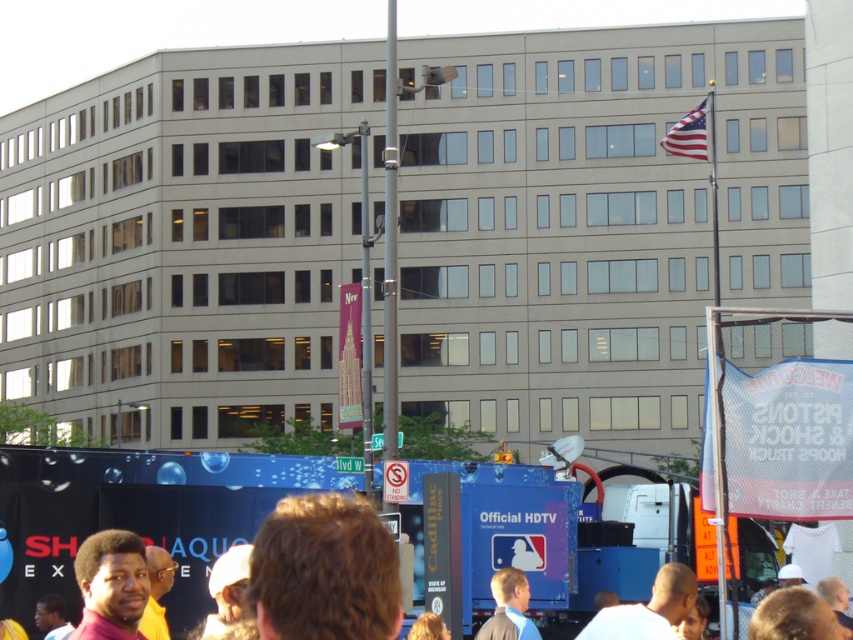
Looking at this image, you are a photographer trying to capture a photo of the MLB truck in the middle ground. You notice two people in the foreground blocking your shot. One has dark brown skin at lower left and the other wears a white fabric turban at lower center. Which person is shorter and should you ask to step back to avoid blocking the MLB truck?

The dark brown skin at lower left is shorter than the white fabric turban at lower center. However, since both are blocking the MLB truck, you should ask both to step back for a clear view.

You are a photographer trying to capture a photo of the dark brown skin at lower left and the white fabric turban at lower center. Which of the two objects is positioned higher in the image?

The dark brown skin at lower left is positioned higher than the white fabric turban at lower center.